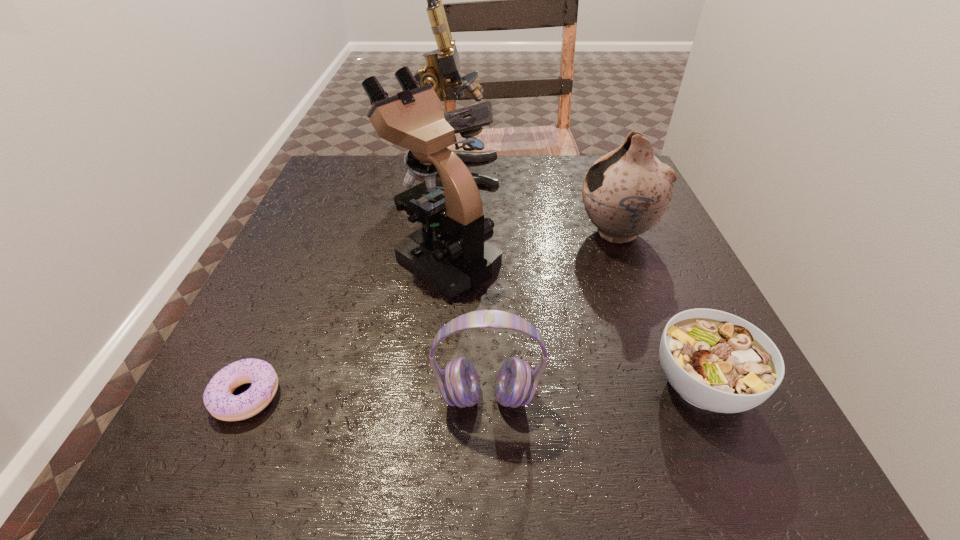
You are a GUI agent. You are given a task and a screenshot of the screen. Output one action in this format:
    pyautogui.click(x=<x>, y=<y>)
    Task: Click on the taller microscope
    Image resolution: width=960 pixels, height=540 pixels.
    Given the screenshot: What is the action you would take?
    pyautogui.click(x=443, y=63)

The image size is (960, 540). What are the coordinates of `the farther microscope` in the screenshot? It's located at (443, 63).

This screenshot has width=960, height=540. Identify the location of the second tallest object. (450, 252).

Locate an element on the screen. the shorter microscope is located at coordinates (450, 252).

The height and width of the screenshot is (540, 960). Identify the location of pottery. (626, 192).

Where is `headset`? headset is located at coordinates (516, 383).

In order to click on the second shortest object in this screenshot , I will do `click(716, 361)`.

Locate an element on the screen. The width and height of the screenshot is (960, 540). doughnut is located at coordinates (220, 402).

Find the location of a particular element. the shortest object is located at coordinates (220, 402).

At what (x,y) coordinates should I click in order to perform the action: click on vacant space positioned 0.290m at the eyepieces of the farther microscope. Please return your answer as a coordinate pair (x, y). This screenshot has width=960, height=540. Looking at the image, I should click on pyautogui.click(x=611, y=172).